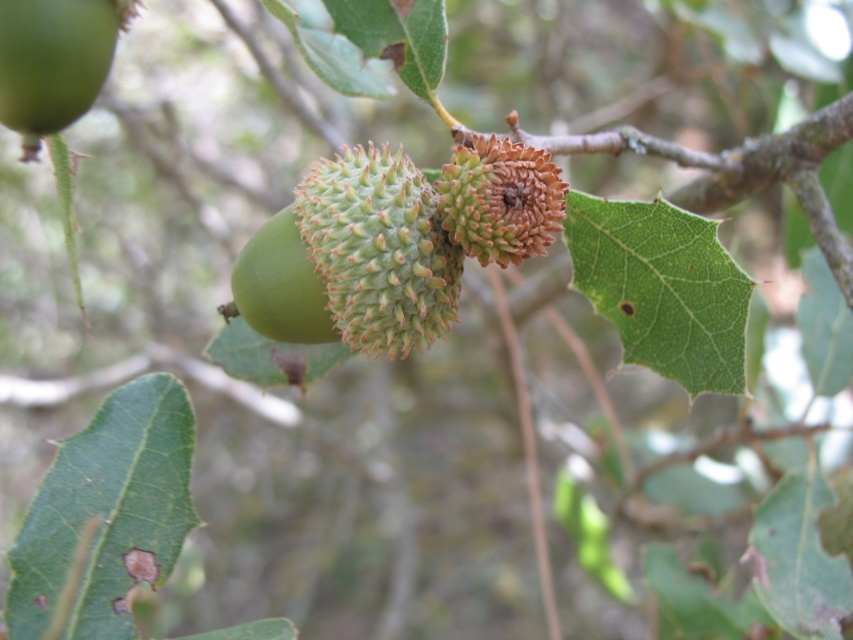
You are holding a camera and want to take a photo of the tree branch with acorns and leaves. The focus point is set to point (409,308). If the camera requires the focus point to be within 5 feet to capture sharp details, will this point be in focus?

The distance of point (409,308) from the camera is 4.84 feet, which is within the 5 feet requirement. Therefore, the focus point will be in focus and capture sharp details.

You are an animal looking for food and see both the green spiky acorn at center and the green matte acorn at center. Which one would you choose if you prefer larger food?

The green spiky acorn at center is larger in size than the green matte acorn at center, so you should choose the green spiky acorn at center.